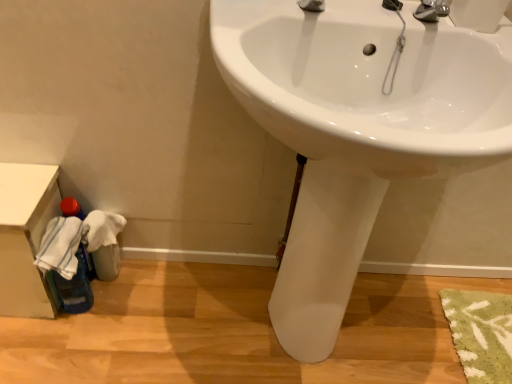
Question: Considering their positions, is white glossy sink at center located in front of or behind white plastic bin at lower left?

Choices:
 (A) behind
 (B) front

Answer: (B)

Question: Considering the positions of white glossy sink at center and white plastic bin at lower left in the image, is white glossy sink at center wider or thinner than white plastic bin at lower left?

Choices:
 (A) thin
 (B) wide

Answer: (B)

Question: Would you say white glossy sink at center is inside or outside white plastic bin at lower left?

Choices:
 (A) inside
 (B) outside

Answer: (B)

Question: In terms of size, does white plastic bin at lower left appear bigger or smaller than white glossy sink at center?

Choices:
 (A) small
 (B) big

Answer: (A)

Question: Considering the positions of point (13, 309) and point (414, 29), is point (13, 309) closer or farther from the camera than point (414, 29)?

Choices:
 (A) closer
 (B) farther

Answer: (B)

Question: From the image's perspective, relative to white glossy sink at center, is white plastic bin at lower left above or below?

Choices:
 (A) below
 (B) above

Answer: (A)

Question: Is white plastic bin at lower left in front of or behind white glossy sink at center in the image?

Choices:
 (A) behind
 (B) front

Answer: (A)